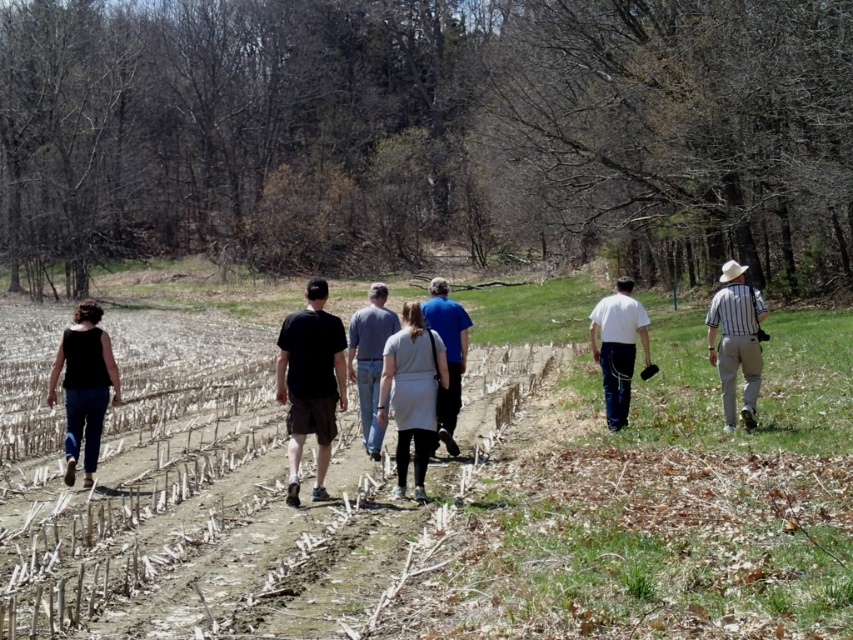
Is light gray dress at center to the right of white striped shirt at right from the viewer's perspective?

No, light gray dress at center is not to the right of white striped shirt at right.

The image size is (853, 640). Find the location of `light gray dress at center`. light gray dress at center is located at coordinates (410, 394).

Locate an element on the screen. The height and width of the screenshot is (640, 853). light gray dress at center is located at coordinates (410, 394).

This screenshot has height=640, width=853. Find the location of `light gray dress at center`. light gray dress at center is located at coordinates (410, 394).

Is light gray dress at center below gray cotton shirt at center?

Yes, light gray dress at center is below gray cotton shirt at center.

What are the coordinates of `light gray dress at center` in the screenshot? It's located at (410, 394).

Describe the element at coordinates (264, 536) in the screenshot. I see `brown dirt path at center` at that location.

Identify the location of brown dirt path at center. (264, 536).

Find the location of a particular element. This screenshot has height=640, width=853. brown dirt path at center is located at coordinates (264, 536).